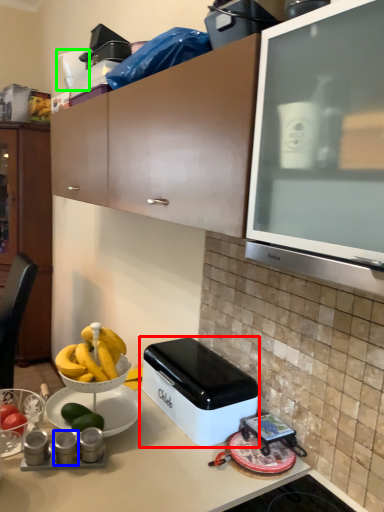
Question: Which object is the farthest from home appliance (highlighted by a red box)? Choose among these: appliance (highlighted by a blue box) or appliance (highlighted by a green box).

Choices:
 (A) appliance
 (B) appliance

Answer: (B)